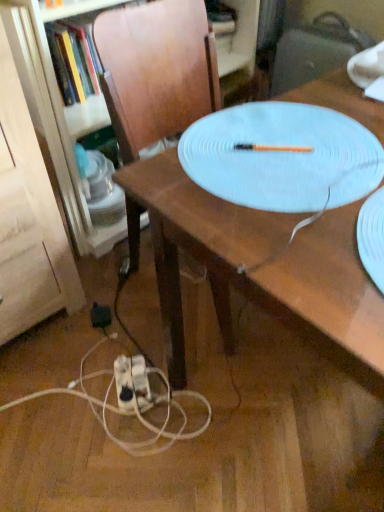
Identify the location of spots to the right of white plastic extension cord at lower center. This screenshot has height=512, width=384. (189, 386).